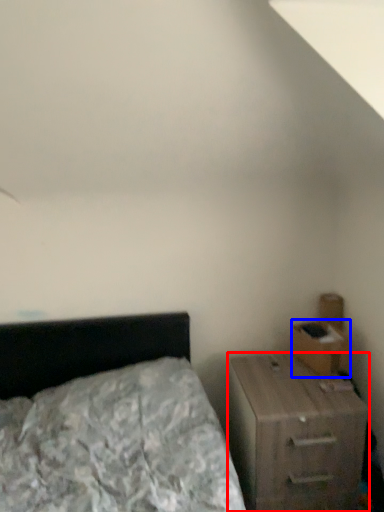
Question: Which of the following is the farthest to the observer, nightstand (highlighted by a red box) or drawer (highlighted by a blue box)?

Choices:
 (A) nightstand
 (B) drawer

Answer: (B)